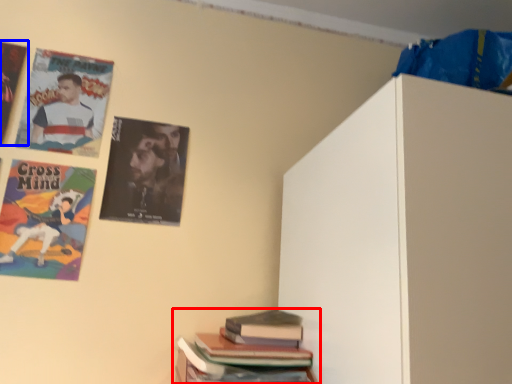
Question: Which object appears closest to the camera in this image, book (highlighted by a red box) or poster (highlighted by a blue box)?

Choices:
 (A) book
 (B) poster

Answer: (A)